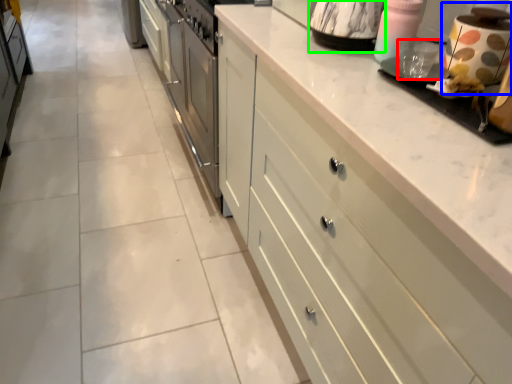
Question: Which object is positioned farthest from appliance (highlighted by a red box)? Select from appliance (highlighted by a blue box) and appliance (highlighted by a green box).

Choices:
 (A) appliance
 (B) appliance

Answer: (B)